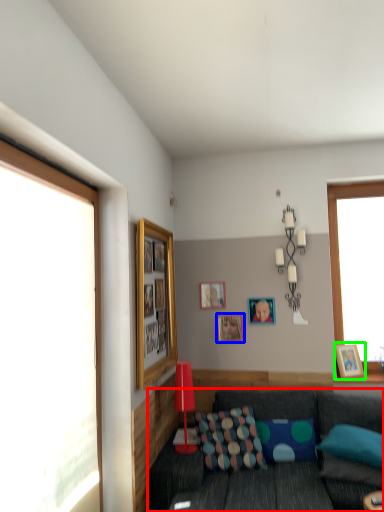
Question: Based on their relative distances, which object is farther from studio couch (highlighted by a red box)? Choose from picture frame (highlighted by a blue box) and picture frame (highlighted by a green box).

Choices:
 (A) picture frame
 (B) picture frame

Answer: (A)